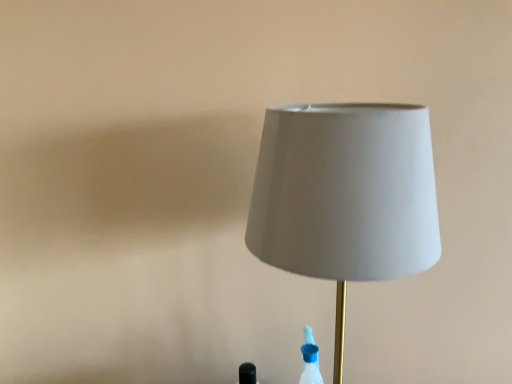
Describe the element at coordinates (345, 196) in the screenshot. I see `matte gray lampshade at center` at that location.

The width and height of the screenshot is (512, 384). I want to click on matte gray lampshade at center, so click(345, 196).

Where is `matte gray lampshade at center`? This screenshot has height=384, width=512. matte gray lampshade at center is located at coordinates (345, 196).